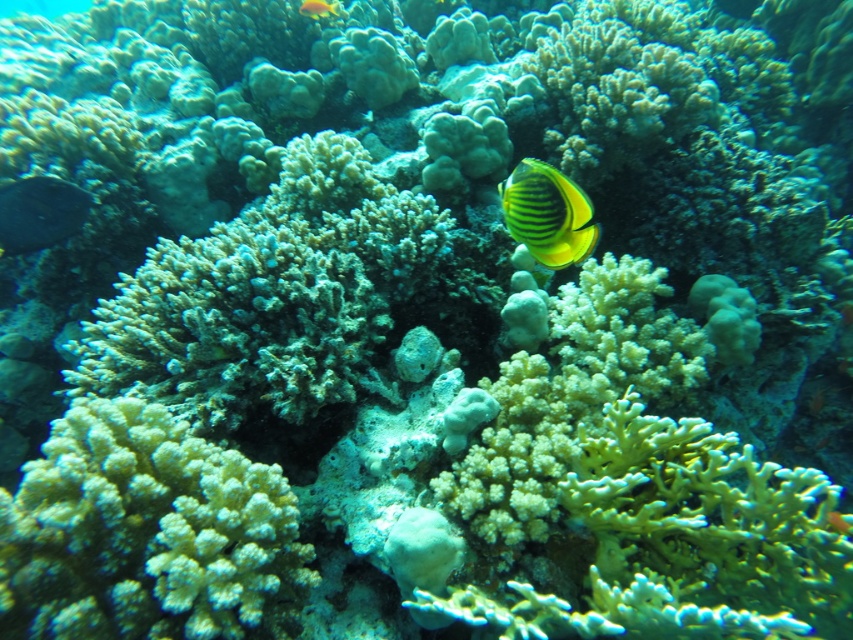
You are a marine biologist studying underwater environments. You are currently at a point 1.20 meters away from the camera. You need to reach a specific point marked at coordinates point (276, 554). Can you determine if you are already at the correct location?

The distance between point (276, 554) and the camera is 1.20 meters. Since you are currently at a point 1.20 meters away from the camera, you are already at the correct location marked at point (276, 554).

You are a marine biologist studying the coral reef. You notice two points in the image. The first point is at coordinate point (56, 552) and the second is at coordinate point (74, 193). Which point is closer to you?

Point (56, 552) is closer to the viewer than point (74, 193).

You are a marine biologist observing this underwater scene. You notice the white porous coral at center and the yellow striped fish at upper center. Which object is positioned closer to your viewpoint?

The white porous coral at center is closer to the viewer than the yellow striped fish at upper center.